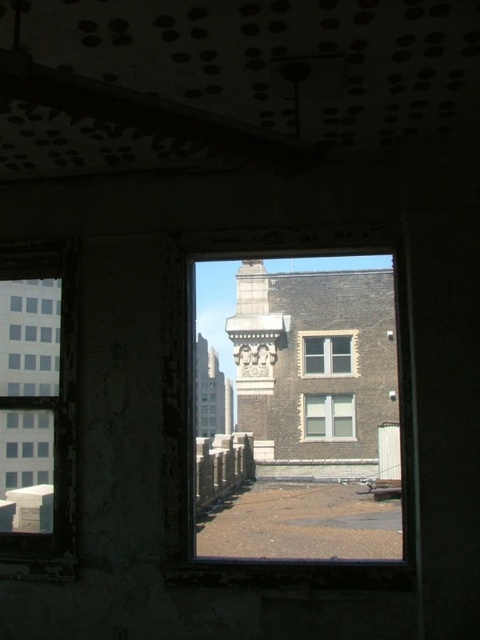
Between brown stone building at center and white glass window at center, which one is positioned higher?

white glass window at center is above.

Which of these two, brown stone building at center or white glass window at center, stands shorter?

white glass window at center

Where is `brown stone building at center`? The image size is (480, 640). brown stone building at center is located at coordinates (299, 420).

Does clear glass window at left have a lesser height compared to white glass window at center?

In fact, clear glass window at left may be taller than white glass window at center.

Where is `clear glass window at left`? clear glass window at left is located at coordinates (37, 408).

Is clear glass window at center above white glass window at center?

Incorrect, clear glass window at center is not positioned above white glass window at center.

Is point (303, 400) positioned behind point (330, 365)?

No, it is in front of (330, 365).

The image size is (480, 640). Describe the element at coordinates (328, 416) in the screenshot. I see `clear glass window at center` at that location.

Find the location of `clear glass window at center`. clear glass window at center is located at coordinates (328, 416).